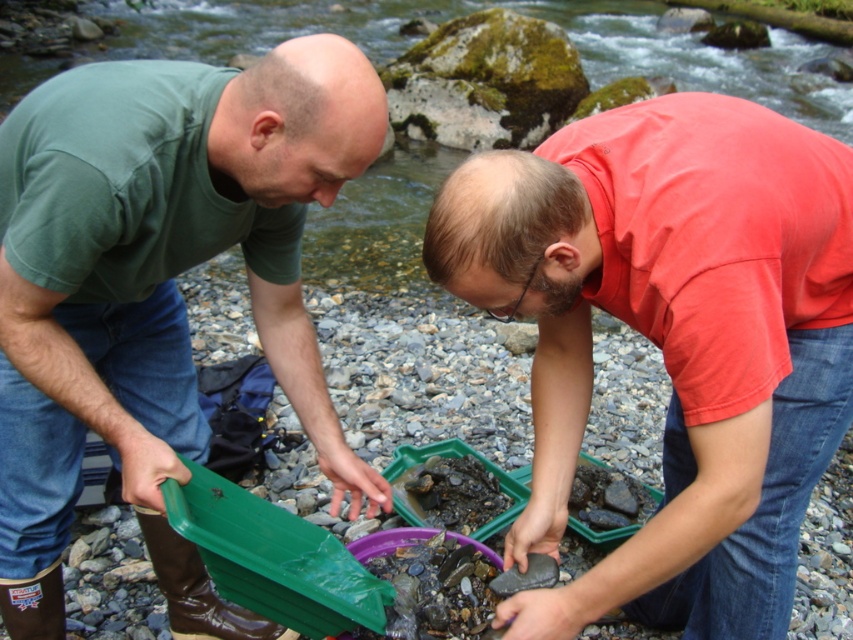
From the picture: You are a hiker who wants to take a photo of the matte red shirt at center and the green matte tray at left. Which object should you focus on first if you want to capture both in the same frame without moving your camera?

You should focus on the matte red shirt at center first because it is located below the green matte tray at left, so adjusting focus to the lower position will help include both in the frame.

You are a photographer trying to capture a clear shot of both the matte red shirt at center and the green matte tray at left. Given their sizes, which object should you focus on first to ensure it appears sharp in the photo?

The matte red shirt at center is thinner than the green matte tray at left, so you should focus on the green matte tray at left first because it is larger and requires more precise focusing to ensure sharpness.

You are a photographer standing at the riverbank and want to capture both the person in the matte red shirt at center and the person in the green T shirt and blue jeans. Which person is closer to you?

The person in the matte red shirt at center is closer to you because their coordinates are at point (x=672, y=339) which is closer than the other person.